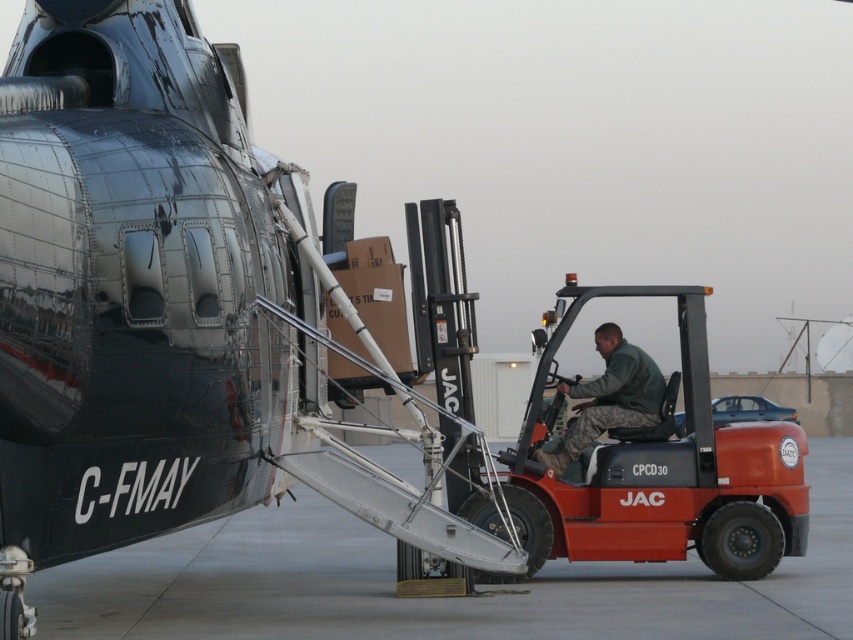
Question: Considering the real-world distances, which object is closest to the shiny metallic airplane at center?

Choices:
 (A) camouflage fabric uniform at right
 (B) metallic gray tarmac at lower center

Answer: (A)

Question: Can you confirm if shiny metallic airplane at center is thinner than camouflage fabric uniform at right?

Choices:
 (A) yes
 (B) no

Answer: (A)

Question: Which point appears farthest from the camera in this image?

Choices:
 (A) (834, 602)
 (B) (577, 410)
 (C) (236, 481)

Answer: (B)

Question: Can you confirm if shiny metallic airplane at center is positioned below metallic gray tarmac at lower center?

Choices:
 (A) no
 (B) yes

Answer: (A)

Question: Which object is farther from the camera taking this photo?

Choices:
 (A) camouflage fabric uniform at right
 (B) shiny metallic airplane at center
 (C) metallic gray tarmac at lower center

Answer: (A)

Question: Is metallic gray tarmac at lower center bigger than camouflage fabric uniform at right?

Choices:
 (A) no
 (B) yes

Answer: (B)